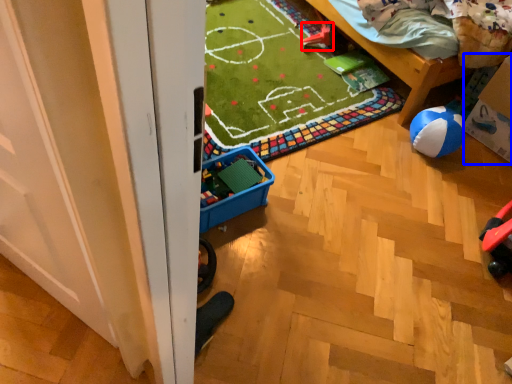
Question: Which of the following is the farthest to the observer, toy (highlighted by a red box) or cardboard box (highlighted by a blue box)?

Choices:
 (A) toy
 (B) cardboard box

Answer: (A)